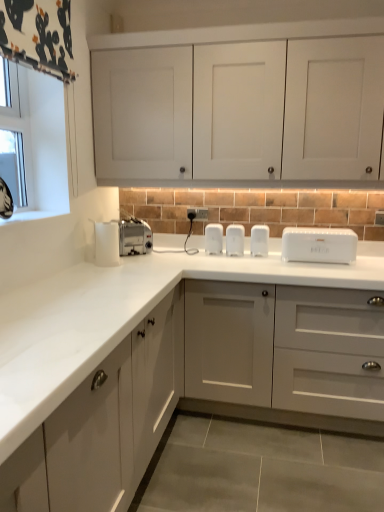
Question: Should I look upward or downward to see white plastic toaster at center, the 4th appliance from the left?

Choices:
 (A) down
 (B) up

Answer: (B)

Question: Could you tell me if clear glass window at upper left is turned towards silver metallic toaster at center?

Choices:
 (A) no
 (B) yes

Answer: (A)

Question: From the image's perspective, would you say clear glass window at upper left is shown under silver metallic toaster at center?

Choices:
 (A) no
 (B) yes

Answer: (A)

Question: From a real-world perspective, is clear glass window at upper left on silver metallic toaster at center?

Choices:
 (A) yes
 (B) no

Answer: (A)

Question: Can you confirm if clear glass window at upper left is taller than silver metallic toaster at center?

Choices:
 (A) yes
 (B) no

Answer: (A)

Question: From the image's perspective, is clear glass window at upper left on silver metallic toaster at center?

Choices:
 (A) yes
 (B) no

Answer: (A)

Question: Is clear glass window at upper left turned away from silver metallic toaster at center?

Choices:
 (A) no
 (B) yes

Answer: (A)

Question: From a real-world perspective, is white plastic electric outlet at center positioned over white plastic bread bin at center based on gravity?

Choices:
 (A) no
 (B) yes

Answer: (B)

Question: Is white plastic electric outlet at center bigger than white plastic bread bin at center?

Choices:
 (A) no
 (B) yes

Answer: (A)

Question: From the image's perspective, is white plastic electric outlet at center located beneath white plastic bread bin at center?

Choices:
 (A) no
 (B) yes

Answer: (A)

Question: Does white plastic electric outlet at center have a lesser width compared to white plastic bread bin at center?

Choices:
 (A) no
 (B) yes

Answer: (B)

Question: Is white plastic electric outlet at center at the right side of white plastic bread bin at center?

Choices:
 (A) no
 (B) yes

Answer: (A)

Question: Is white plastic bread bin at center a part of white plastic electric outlet at center?

Choices:
 (A) no
 (B) yes

Answer: (A)

Question: Is silver metallic toaster at center thinner than white matte cabinet doors at upper center, positioned as the 2th cabinetry in bottom-to-top order?

Choices:
 (A) no
 (B) yes

Answer: (B)